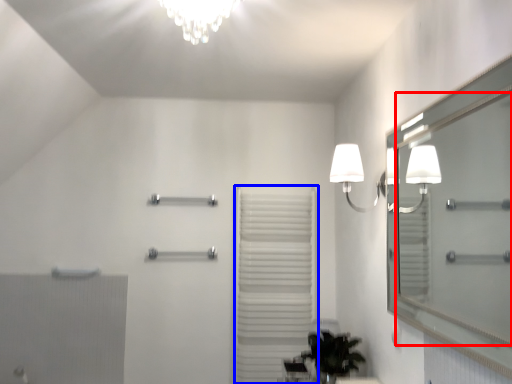
Question: Which point is closer to the camera, mirror (highlighted by a red box) or curtain (highlighted by a blue box)?

Choices:
 (A) mirror
 (B) curtain

Answer: (A)